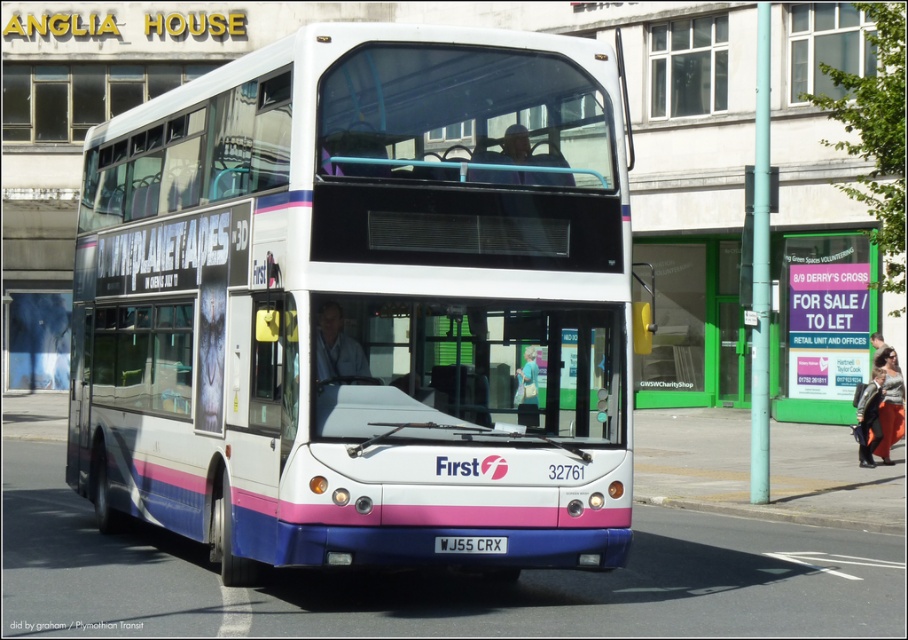
Is white glossy decker bus at center above white plastic license plate at center?

Correct, white glossy decker bus at center is located above white plastic license plate at center.

Does point (281, 131) come behind point (447, 541)?

Yes, it is behind point (447, 541).

Locate an element on the screen. white glossy decker bus at center is located at coordinates (364, 304).